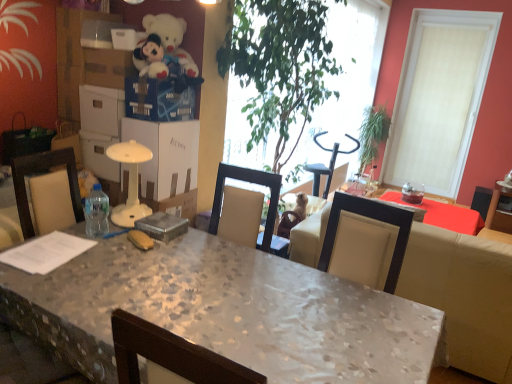
Image resolution: width=512 pixels, height=384 pixels. What are the coordinates of `free spot to the right of metallic gray box at center` in the screenshot? It's located at (197, 241).